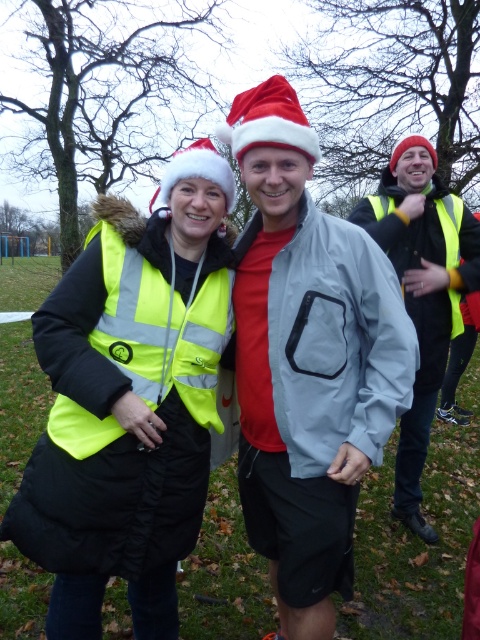
Consider the image. Who is shorter, neon yellow reflective vest at center or neon yellow reflective safety vest at left?

With less height is neon yellow reflective safety vest at left.

Does neon yellow reflective vest at center have a greater width compared to neon yellow reflective safety vest at left?

Yes, neon yellow reflective vest at center is wider than neon yellow reflective safety vest at left.

Is point (85, 596) farther from camera compared to point (216, 317)?

That is False.

Where is `neon yellow reflective vest at center`? The height and width of the screenshot is (640, 480). neon yellow reflective vest at center is located at coordinates (131, 401).

Is neon yellow reflective vest at center wider than yellow high-visibility vest at right?

Indeed, neon yellow reflective vest at center has a greater width compared to yellow high-visibility vest at right.

Does neon yellow reflective vest at center have a larger size compared to yellow high-visibility vest at right?

Yes.

I want to click on neon yellow reflective vest at center, so click(x=131, y=401).

You are a GUI agent. You are given a task and a screenshot of the screen. Output one action in this format:
    pyautogui.click(x=<x>, y=<y>)
    Task: Click on the neon yellow reflective vest at center
    The height and width of the screenshot is (640, 480).
    Given the screenshot: What is the action you would take?
    pyautogui.click(x=131, y=401)

Which is below, neon yellow reflective vest at center or matte gray jacket at center?

matte gray jacket at center

Is point (68, 573) positioned behind point (360, 310)?

No, (68, 573) is in front of (360, 310).

Where is `neon yellow reflective vest at center`? The height and width of the screenshot is (640, 480). neon yellow reflective vest at center is located at coordinates (131, 401).

Identify the location of neon yellow reflective vest at center. (131, 401).